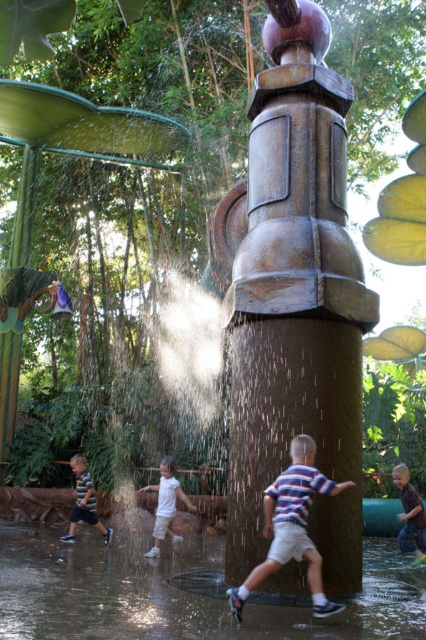
You are a photographer at the water park and need to capture both the striped cotton shirt at center and the brown cotton shirt at center in a single shot. Which shirt should you focus on first to ensure both are in frame?

The striped cotton shirt at center is taller than the brown cotton shirt at center, so you should focus on the striped cotton shirt at center first to ensure both are in frame.